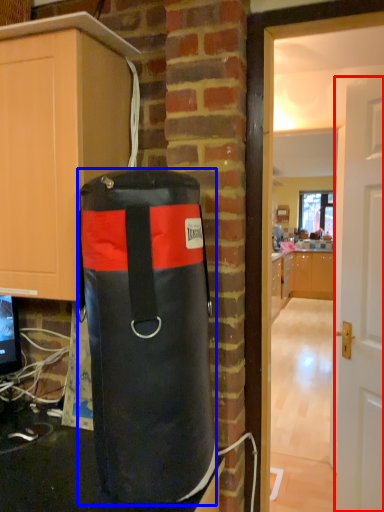
Question: Among these objects, which one is nearest to the camera, door (highlighted by a red box) or punching bag (highlighted by a blue box)?

Choices:
 (A) door
 (B) punching bag

Answer: (B)